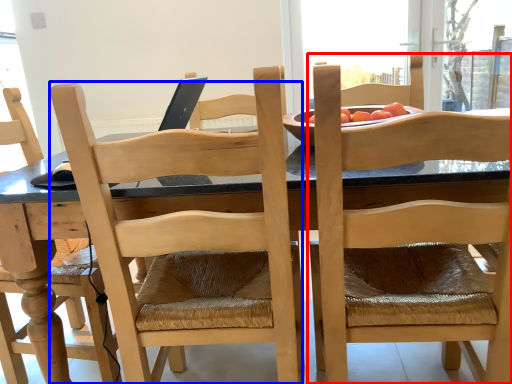
Question: Among these objects, which one is farthest to the camera, chair (highlighted by a red box) or chair (highlighted by a blue box)?

Choices:
 (A) chair
 (B) chair

Answer: (B)